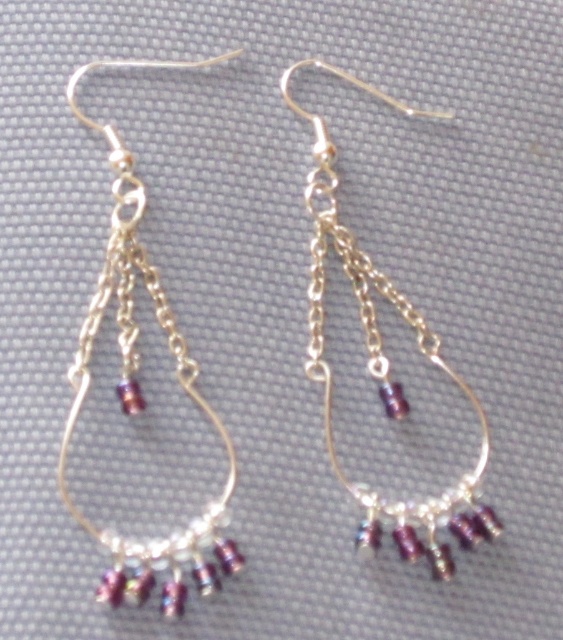
Which of these two, matte silver chain at left or silver/golden chain earrings at center, stands taller?

With more height is matte silver chain at left.

Where is `matte silver chain at left`? This screenshot has width=563, height=640. matte silver chain at left is located at coordinates (140, 388).

Which is behind, point (181, 378) or point (310, 376)?

Point (310, 376)

I want to click on matte silver chain at left, so click(x=140, y=388).